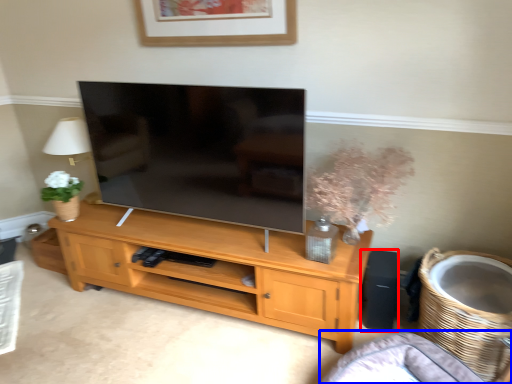
Question: Which of the following is the closest to the observer, speaker (highlighted by a red box) or couch (highlighted by a blue box)?

Choices:
 (A) speaker
 (B) couch

Answer: (B)